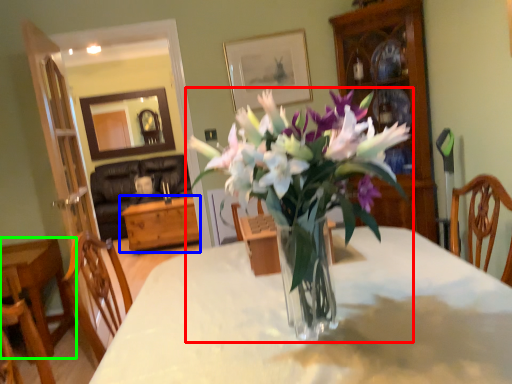
Question: Based on their relative distances, which object is farther from houseplant (highlighted by a red box)? Choose from table (highlighted by a blue box) and table (highlighted by a green box).

Choices:
 (A) table
 (B) table

Answer: (A)